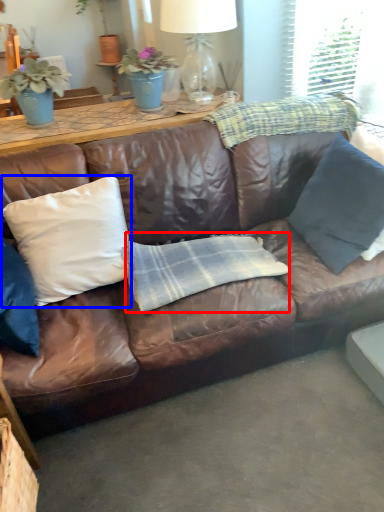
Question: Which point is closer to the camera, plaid (highlighted by a red box) or pillow (highlighted by a blue box)?

Choices:
 (A) plaid
 (B) pillow

Answer: (B)